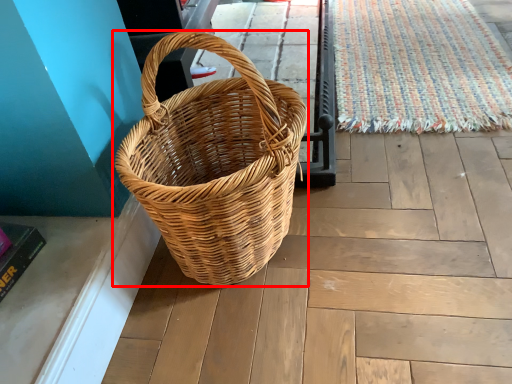
Question: Observing the image, what is the correct spatial positioning of picnic basket (annotated by the red box) in reference to doormat?

Choices:
 (A) right
 (B) left

Answer: (B)